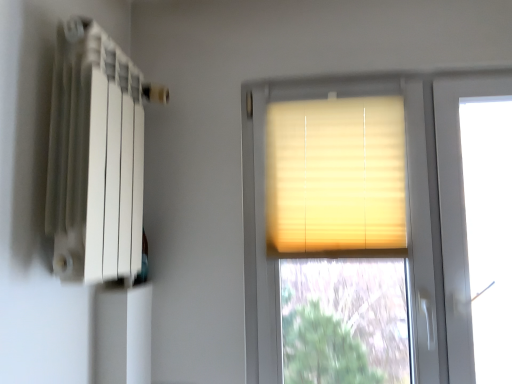
Question: Is white matte radiator at left a part of matte yellow blinds at center?

Choices:
 (A) yes
 (B) no

Answer: (B)

Question: Is matte yellow blinds at center oriented away from white matte radiator at left?

Choices:
 (A) yes
 (B) no

Answer: (B)

Question: Can you confirm if matte yellow blinds at center is thinner than white matte radiator at left?

Choices:
 (A) yes
 (B) no

Answer: (A)

Question: Is matte yellow blinds at center to the right of white matte radiator at left from the viewer's perspective?

Choices:
 (A) no
 (B) yes

Answer: (B)

Question: Is matte yellow blinds at center at the left side of white matte radiator at left?

Choices:
 (A) yes
 (B) no

Answer: (B)

Question: Does matte yellow blinds at center have a larger size compared to white matte radiator at left?

Choices:
 (A) no
 (B) yes

Answer: (B)

Question: Is white matte radiator at left far from beige fabric blinds at center?

Choices:
 (A) yes
 (B) no

Answer: (B)

Question: Can you confirm if white matte radiator at left is positioned to the right of beige fabric blinds at center?

Choices:
 (A) no
 (B) yes

Answer: (A)

Question: Considering the relative sizes of white matte radiator at left and beige fabric blinds at center in the image provided, is white matte radiator at left taller than beige fabric blinds at center?

Choices:
 (A) no
 (B) yes

Answer: (B)

Question: Considering the relative sizes of white matte radiator at left and beige fabric blinds at center in the image provided, is white matte radiator at left wider than beige fabric blinds at center?

Choices:
 (A) no
 (B) yes

Answer: (B)

Question: Is white matte radiator at left facing towards beige fabric blinds at center?

Choices:
 (A) yes
 (B) no

Answer: (A)

Question: Is the depth of white matte radiator at left greater than that of beige fabric blinds at center?

Choices:
 (A) yes
 (B) no

Answer: (B)

Question: From the image's perspective, is beige fabric blinds at center under matte yellow blinds at center?

Choices:
 (A) yes
 (B) no

Answer: (B)